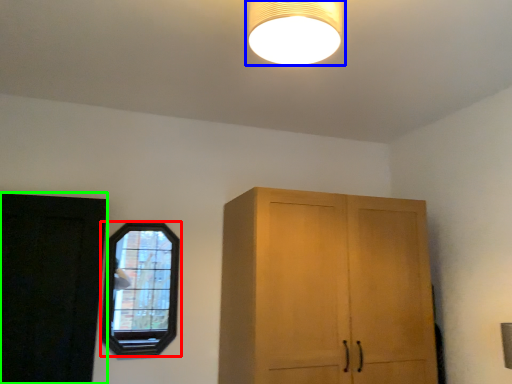
Question: Estimate the real-world distances between objects in this image. Which object is farther from window (highlighted by a red box), lamp (highlighted by a blue box) or door (highlighted by a green box)?

Choices:
 (A) lamp
 (B) door

Answer: (A)